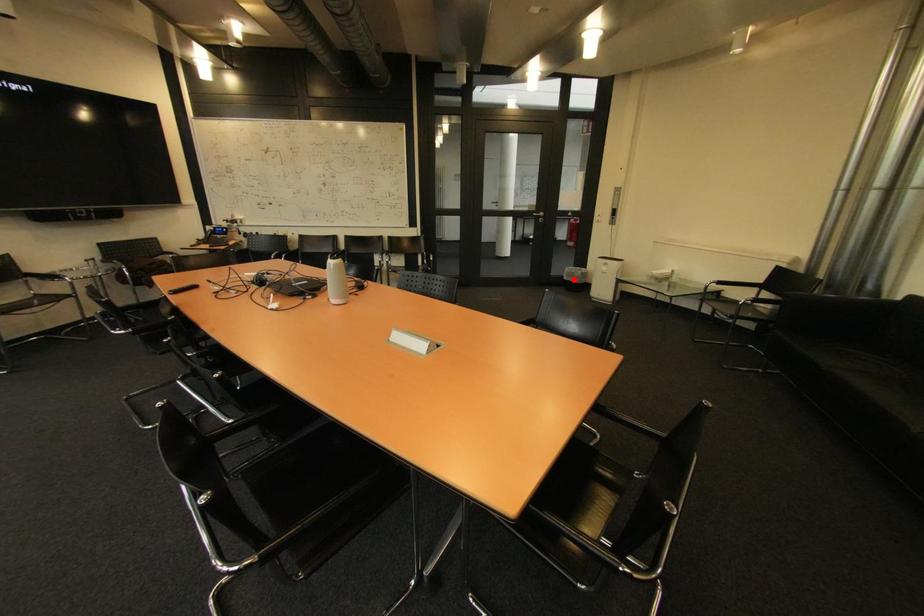
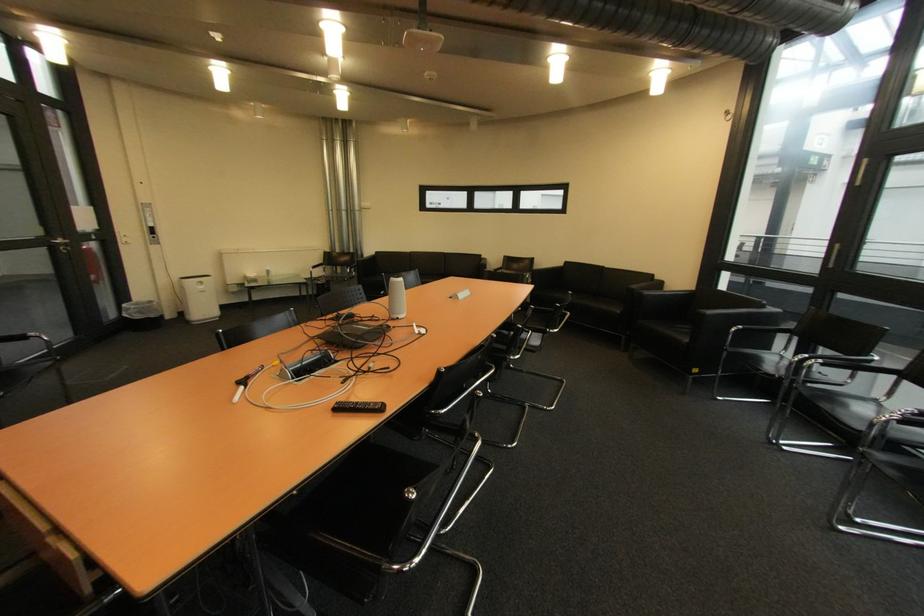
Question: I am providing you with two images of the same scene from different viewpoints. Image1 has a red point marked. In image2, the corresponding 3D location appears at what relative position? Reply with the corresponding letter.

Choices:
 (A) Closer
 (B) Farther

Answer: (B)